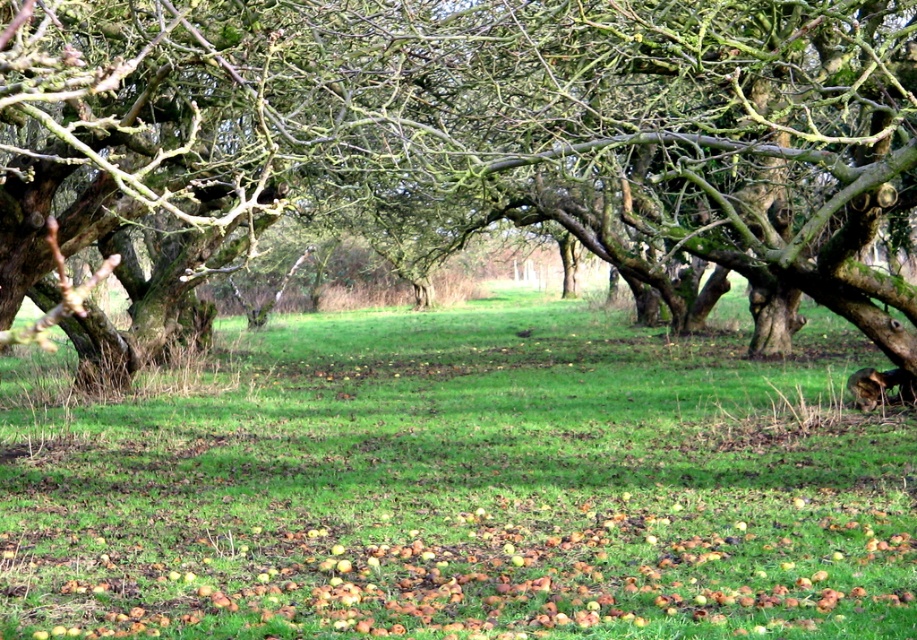
Question: Does brown rough tree at center appear on the left side of brown rough apples at lower center?

Choices:
 (A) yes
 (B) no

Answer: (B)

Question: Among these points, which one is farthest from the camera?

Choices:
 (A) (808, 515)
 (B) (714, 76)
 (C) (391, 387)

Answer: (C)

Question: Is brown rough tree at center bigger than brown rough apples at lower center?

Choices:
 (A) no
 (B) yes

Answer: (B)

Question: Which object is farther from the camera taking this photo?

Choices:
 (A) brown rough tree at center
 (B) green grass at center

Answer: (B)

Question: Estimate the real-world distances between objects in this image. Which object is farther from the brown rough tree at center?

Choices:
 (A) brown rough apples at lower center
 (B) green grass at center

Answer: (A)

Question: Is green grass at center smaller than brown rough tree at center?

Choices:
 (A) no
 (B) yes

Answer: (B)